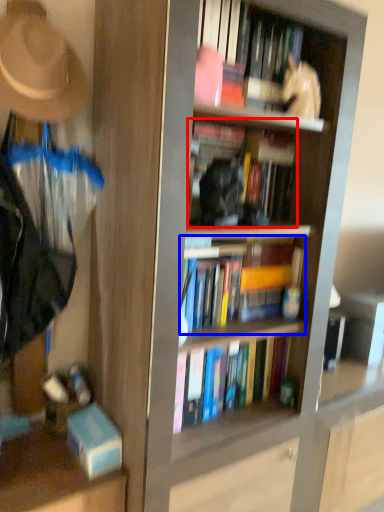
Question: Which object is further to the camera taking this photo, book (highlighted by a red box) or book (highlighted by a blue box)?

Choices:
 (A) book
 (B) book

Answer: (B)